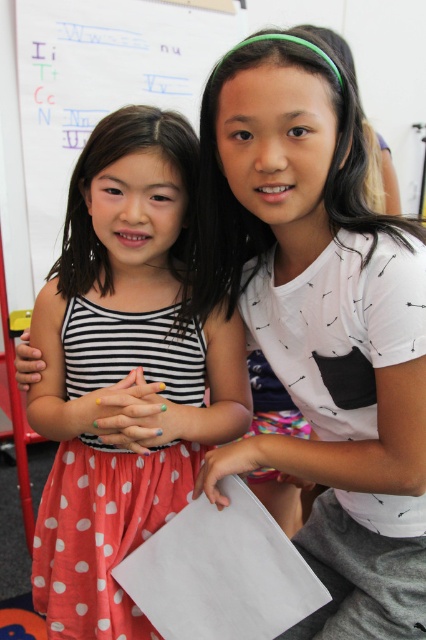
Question: Among these objects, which one is nearest to the camera?

Choices:
 (A) white paper at upper center
 (B) polka dot fabric dress at center

Answer: (B)

Question: Considering the relative positions of polka dot fabric dress at center and white paper at upper center in the image provided, where is polka dot fabric dress at center located with respect to white paper at upper center?

Choices:
 (A) right
 (B) left

Answer: (A)

Question: Considering the real-world distances, which object is closest to the polka dot fabric dress at center?

Choices:
 (A) white printed shirt at upper right
 (B) white paper at upper center

Answer: (A)

Question: Is polka dot fabric dress at center smaller than white paper at upper center?

Choices:
 (A) no
 (B) yes

Answer: (B)

Question: Which point is closer to the camera taking this photo?

Choices:
 (A) click(302, 474)
 (B) click(103, 497)
 (C) click(101, 81)

Answer: (A)

Question: Is polka dot fabric dress at center closer to the viewer compared to white paper at upper center?

Choices:
 (A) yes
 (B) no

Answer: (A)